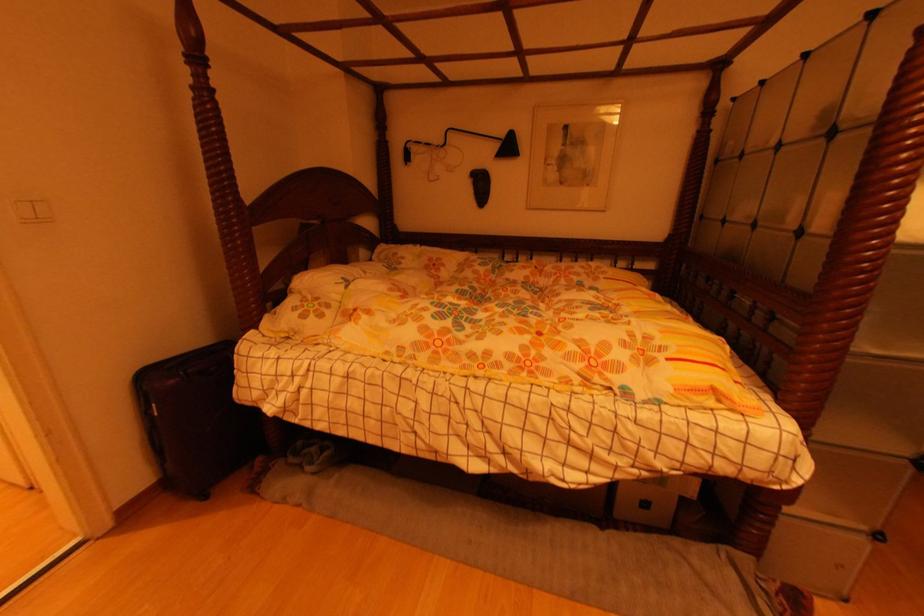
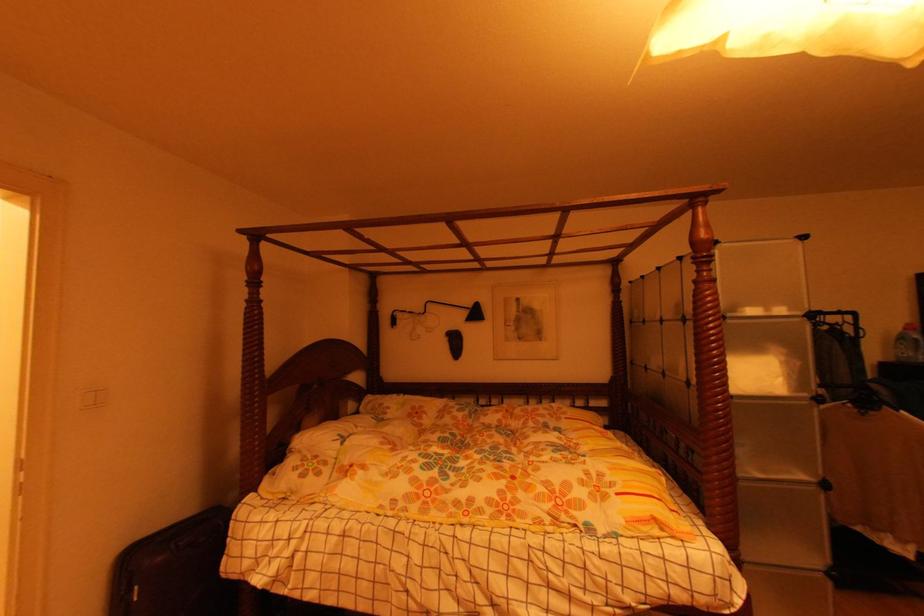
Question: How did the camera likely rotate?

Choices:
 (A) Left
 (B) Right
 (C) Up
 (D) Down

Answer: (C)